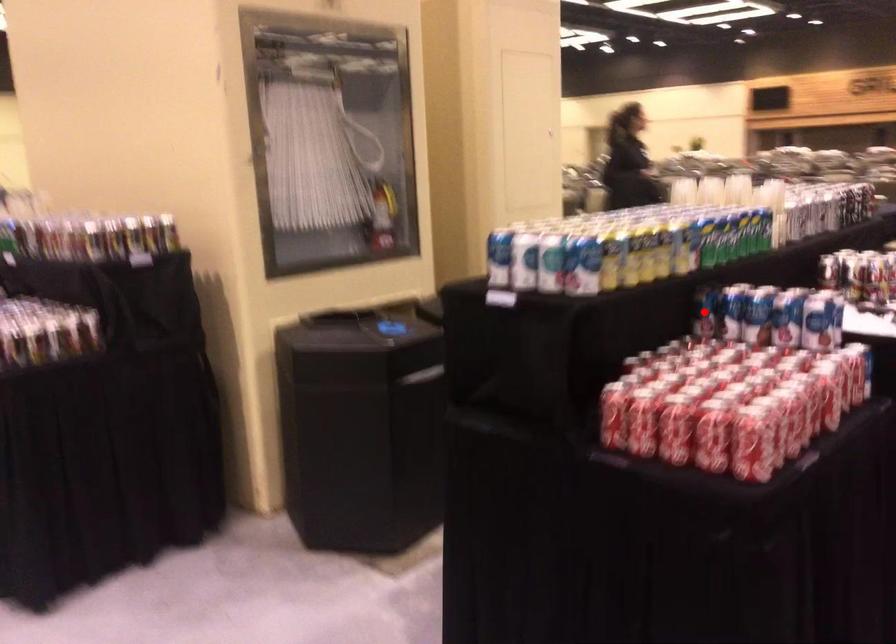
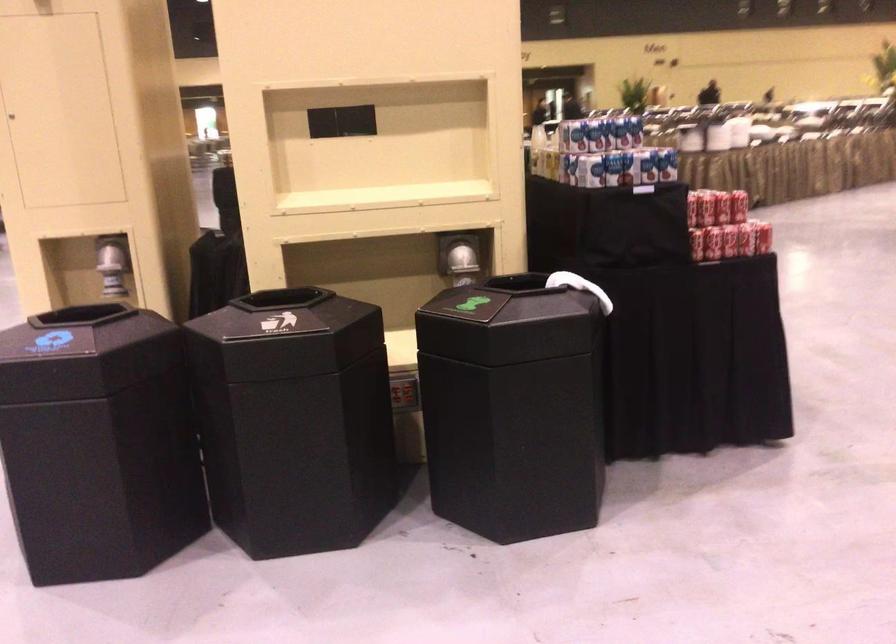
Question: I am providing you with two images of the same scene from different viewpoints. A red point is marked on the first image. At the location where the point appears in image 1, is it still visible in image 2?

Choices:
 (A) Yes
 (B) No

Answer: (B)